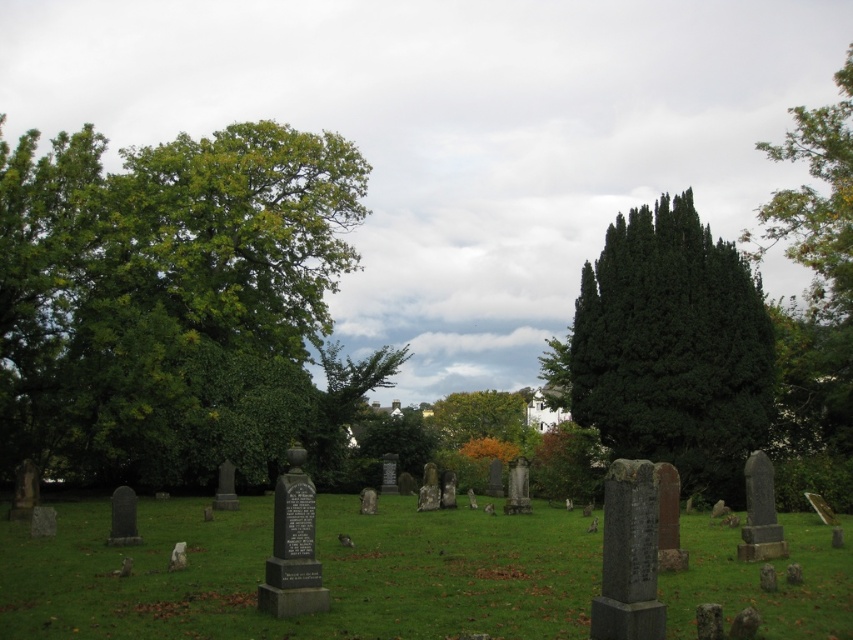
You are standing at the edge of the cemetery looking towards the gray stone gravestones at center. There is a green leafy tree at left. If you want to walk directly to the gravestones, will the tree block your path?

The green leafy tree at left is positioned over gray stone gravestones at center, so the tree will block your path to the gravestones.

You are standing at the center of the cemetery and see a point marked at coordinates (177, 305). What object is located at this point?

The point at coordinates (177, 305) marks the green leafy tree at left.

You are standing at point (177, 305) in the cemetery. Looking around, you see a green leafy tree at left. Which direction should you walk to get closer to the green leafy tree at left?

Since you are already at the point where the green leafy tree at left is located, you are already at the base of the green leafy tree at left. There is no need to walk further.